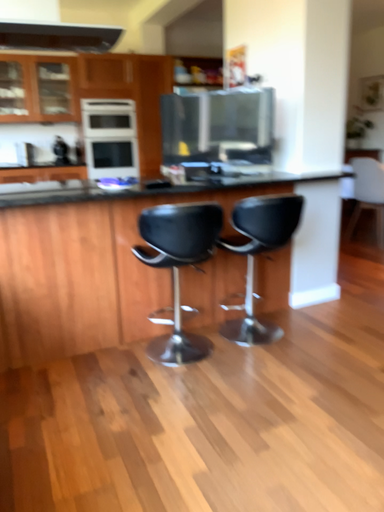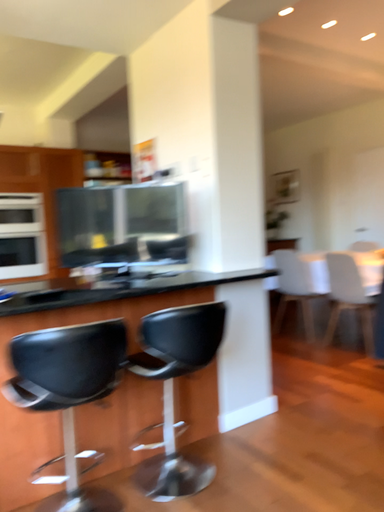
Question: How did the camera likely rotate when shooting the video?

Choices:
 (A) rotated downward
 (B) rotated upward

Answer: (B)